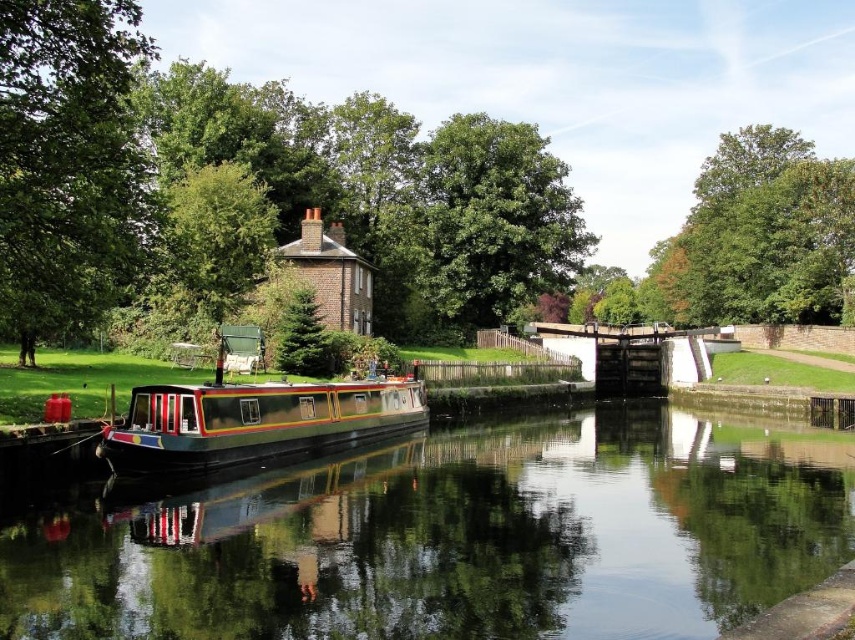
Does green leafy tree at upper center have a smaller size compared to green leafy tree at upper left?

Incorrect, green leafy tree at upper center is not smaller in size than green leafy tree at upper left.

Is green leafy tree at upper center positioned at the back of green leafy tree at upper left?

No.

Identify the location of green leafy tree at upper center. click(x=254, y=189).

Locate an element on the screen. This screenshot has height=640, width=855. green leafy tree at upper center is located at coordinates (254, 189).

Is point (57, 58) less distant than point (208, 196)?

Yes, it is.

Which is behind, point (63, 38) or point (186, 179)?

Positioned behind is point (186, 179).

Find the location of a particular element. Image resolution: width=855 pixels, height=640 pixels. green leafy tree at left is located at coordinates (66, 161).

Between green leafy tree at upper right and metallic polished barge at center, which one is positioned higher?

green leafy tree at upper right

Is point (722, 150) positioned behind point (198, 413)?

Yes, point (722, 150) is behind point (198, 413).

Which is behind, point (774, 308) or point (296, 429)?

The point (774, 308) is behind.

Where is `green leafy tree at upper right`? Image resolution: width=855 pixels, height=640 pixels. green leafy tree at upper right is located at coordinates (758, 236).